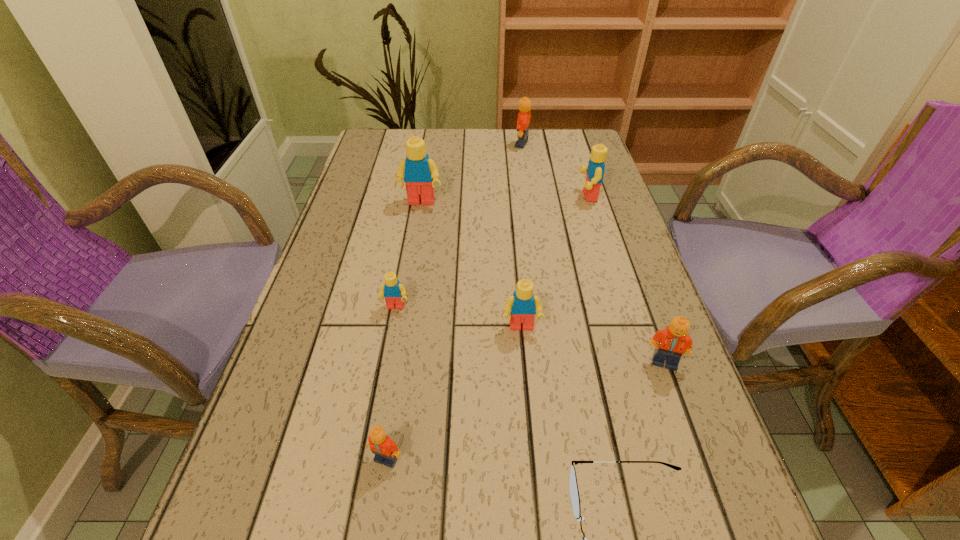
Locate an element on the screen. The height and width of the screenshot is (540, 960). Lego that is the fifth closest to the second biggest yellow Lego is located at coordinates (394, 293).

Locate which yellow Lego is the second closest to the rightmost orange Lego. Please provide its 2D coordinates. Your answer should be formatted as a tuple, i.e. [(x, y)], where the tuple contains the x and y coordinates of a point satisfying the conditions above.

[(394, 293)]

This screenshot has width=960, height=540. In order to click on yellow Lego that is the nearest to the black spectacles in this screenshot , I will do `click(523, 305)`.

Identify the location of orange Lego identified as the closest to the third smallest yellow Lego. The image size is (960, 540). [x=523, y=123].

Locate which orange Lego ranks in proximity to the third nearest object. Please provide its 2D coordinates. Your answer should be formatted as a tuple, i.e. [(x, y)], where the tuple contains the x and y coordinates of a point satisfying the conditions above.

[(386, 452)]

Where is `vacant space that satisfies the following two spatial constraints: 1. on the front-facing side of the farthest object; 2. on the front-facing side of the nearest yellow Lego`? vacant space that satisfies the following two spatial constraints: 1. on the front-facing side of the farthest object; 2. on the front-facing side of the nearest yellow Lego is located at coordinates (548, 328).